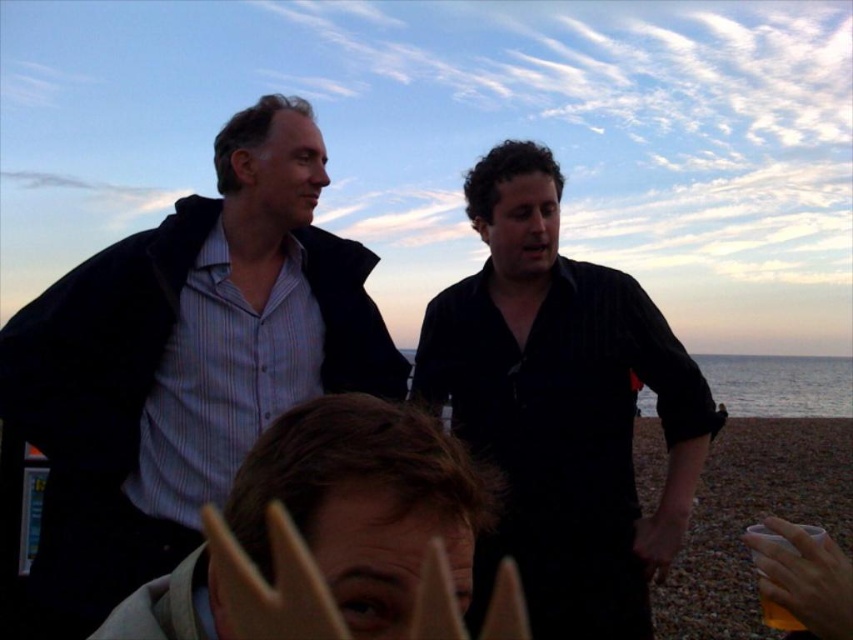
Measure the distance between black matte shirt at center and translucent plastic cup at lower right.

The distance of black matte shirt at center from translucent plastic cup at lower right is 4.80 feet.

Between point (439, 296) and point (753, 529), which one is positioned in front?

Point (753, 529) is in front.

You are a GUI agent. You are given a task and a screenshot of the screen. Output one action in this format:
    pyautogui.click(x=<x>, y=<y>)
    Task: Click on the black matte shirt at center
    
    Given the screenshot: What is the action you would take?
    tap(561, 406)

The width and height of the screenshot is (853, 640). What do you see at coordinates (184, 362) in the screenshot?
I see `matte black jacket at left` at bounding box center [184, 362].

Which of these two, matte black jacket at left or brown hair at center, stands shorter?

brown hair at center is shorter.

Locate an element on the screen. Image resolution: width=853 pixels, height=640 pixels. matte black jacket at left is located at coordinates (184, 362).

Does matte black jacket at left appear under black matte shirt at center?

Incorrect, matte black jacket at left is not positioned below black matte shirt at center.

Which is more to the left, matte black jacket at left or black matte shirt at center?

matte black jacket at left is more to the left.

Does point (33, 339) come farther from viewer compared to point (529, 324)?

No, (33, 339) is closer to viewer.

Locate an element on the screen. matte black jacket at left is located at coordinates (184, 362).